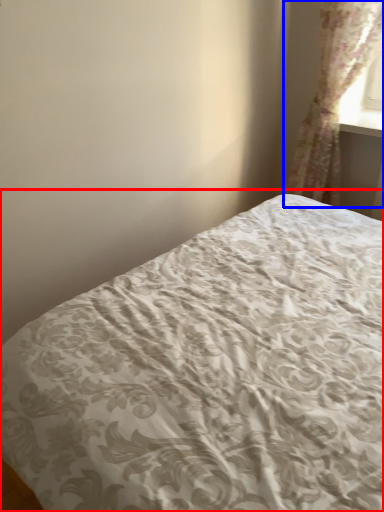
Question: Which point is closer to the camera, bed (highlighted by a red box) or curtain (highlighted by a blue box)?

Choices:
 (A) bed
 (B) curtain

Answer: (A)